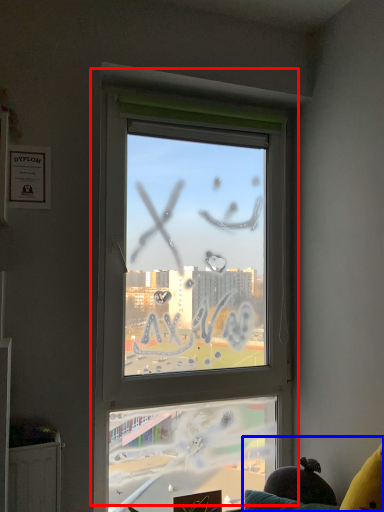
Question: Which object appears closest to the camera in this image, window (highlighted by a red box) or couch (highlighted by a blue box)?

Choices:
 (A) window
 (B) couch

Answer: (B)